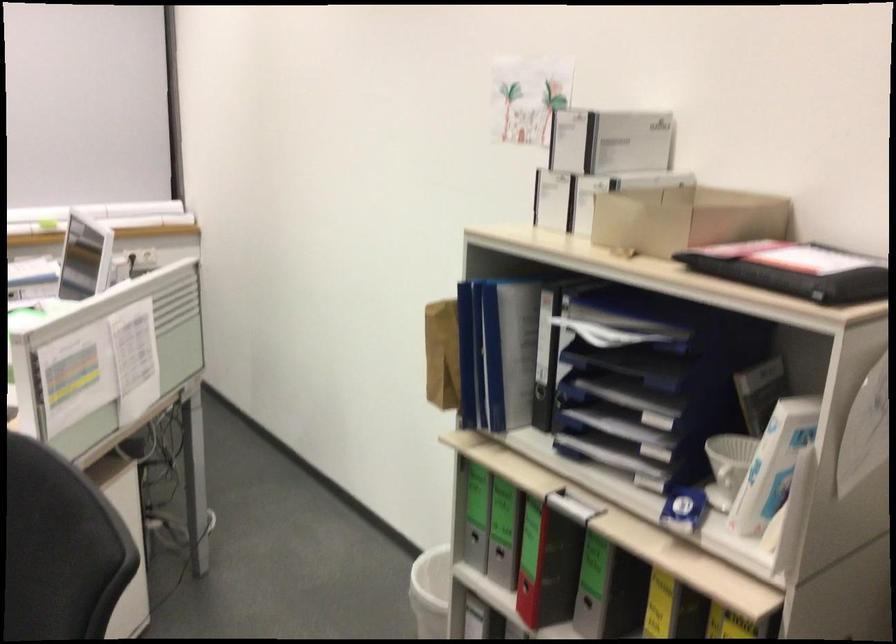
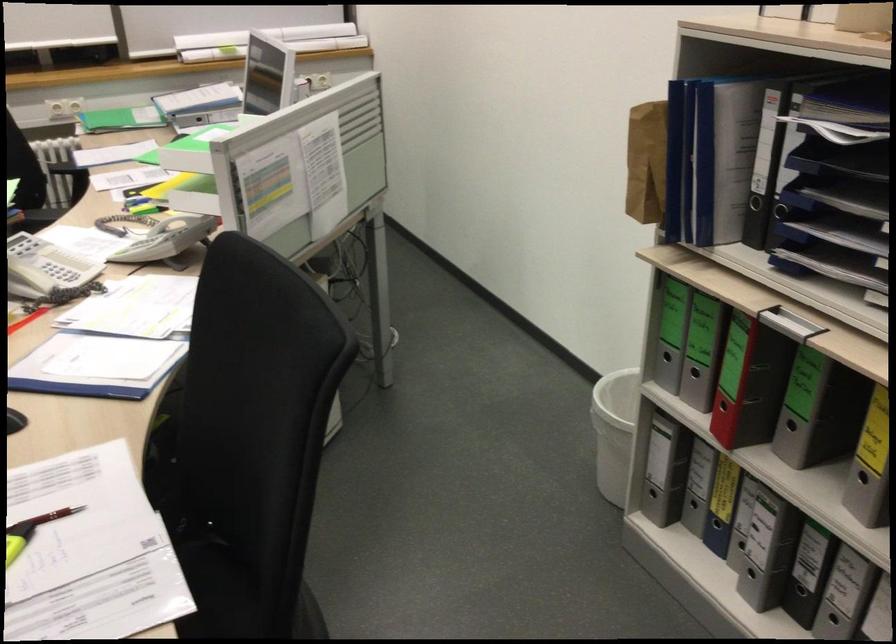
Where in the second image is the point corresponding to [612,386] from the first image?

(840, 194)